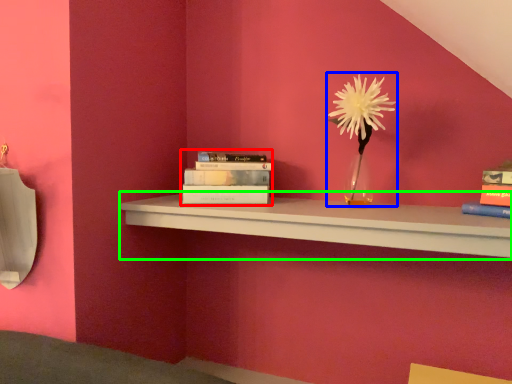
Question: Estimate the real-world distances between objects in this image. Which object is farther from book (highlighted by a red box), floral arrangement (highlighted by a blue box) or shelf (highlighted by a green box)?

Choices:
 (A) floral arrangement
 (B) shelf

Answer: (A)